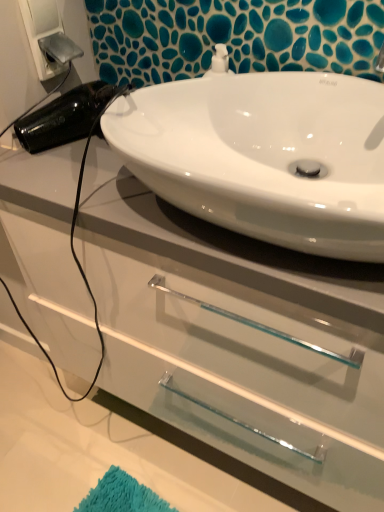
Question: Is white glossy cabinet at center bigger or smaller than white plastic electric outlet at upper left?

Choices:
 (A) small
 (B) big

Answer: (B)

Question: Considering the positions of white glossy cabinet at center and white plastic electric outlet at upper left in the image, is white glossy cabinet at center wider or thinner than white plastic electric outlet at upper left?

Choices:
 (A) wide
 (B) thin

Answer: (A)

Question: Which is nearer to the white glossy sink at upper center?

Choices:
 (A) white glossy cabinet at center
 (B) white plastic electric outlet at upper left

Answer: (A)

Question: Estimate the real-world distances between objects in this image. Which object is closer to the white plastic electric outlet at upper left?

Choices:
 (A) white glossy sink at upper center
 (B) white glossy cabinet at center

Answer: (A)